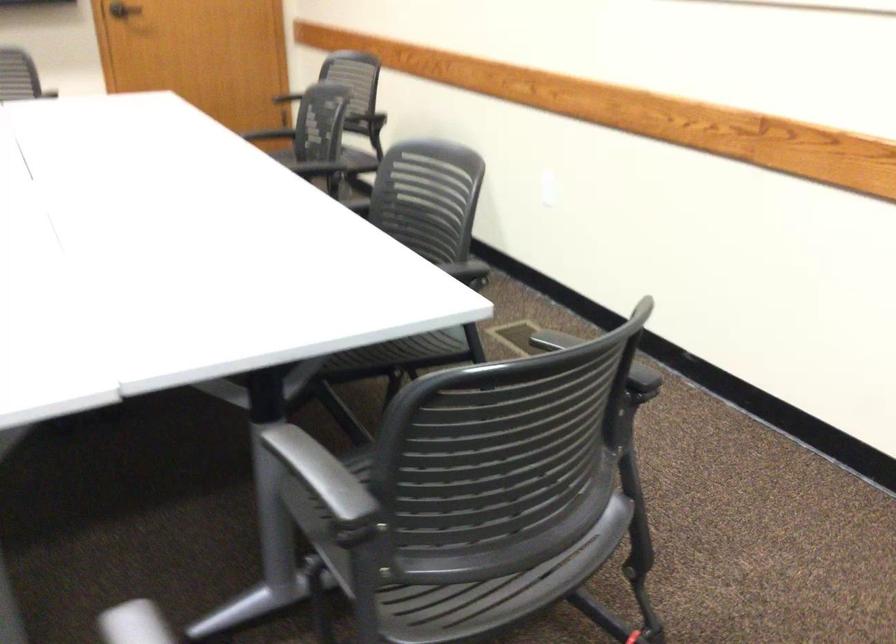
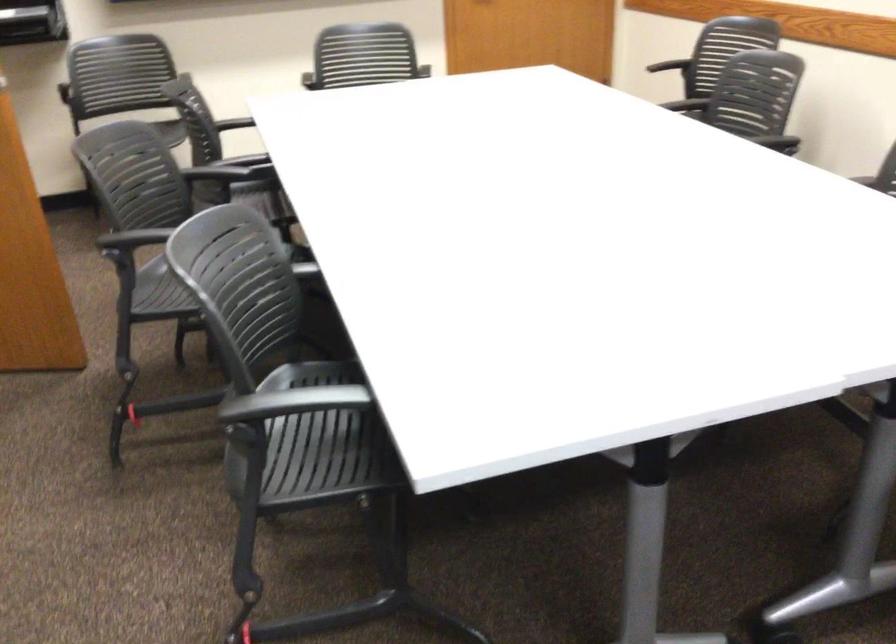
Question: What movement of the cameraman would produce the second image?

Choices:
 (A) Left
 (B) Right
 (C) Forward
 (D) Backward

Answer: (A)